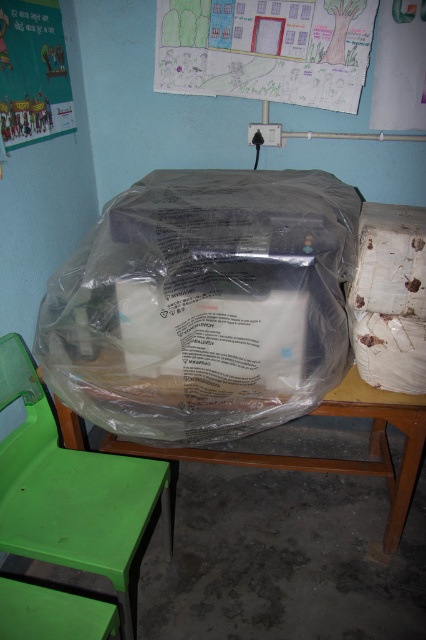
Question: Where is transparent plastic printer at center located in relation to wooden table at center in the image?

Choices:
 (A) above
 (B) below

Answer: (A)

Question: Which point is farther to the camera?

Choices:
 (A) (247, 38)
 (B) (34, 112)

Answer: (A)

Question: Does transparent plastic printer at center have a lesser width compared to wooden table at center?

Choices:
 (A) no
 (B) yes

Answer: (B)

Question: Which of these objects is positioned farthest from the wooden table at center?

Choices:
 (A) transparent plastic printer at center
 (B) green plastic chair at lower left
 (C) colored paper drawing at upper center
 (D) matte paper poster at upper left

Answer: (C)

Question: Which point appears closest to the camera in this image?

Choices:
 (A) (167, 4)
 (B) (58, 387)
 (C) (388, 419)
 (D) (40, 400)

Answer: (C)

Question: Does colored paper drawing at upper center appear on the left side of matte paper poster at upper left?

Choices:
 (A) no
 (B) yes

Answer: (A)